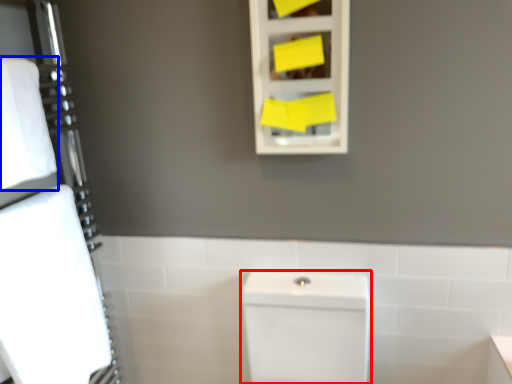
Question: Among these objects, which one is farthest to the camera, porcelain (highlighted by a red box) or bath towel (highlighted by a blue box)?

Choices:
 (A) porcelain
 (B) bath towel

Answer: (B)